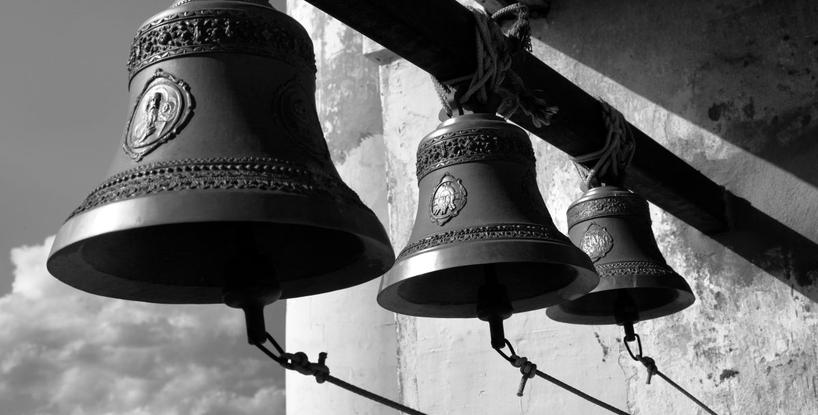
Where is `wall`? This screenshot has height=415, width=818. wall is located at coordinates (721, 304), (720, 330).